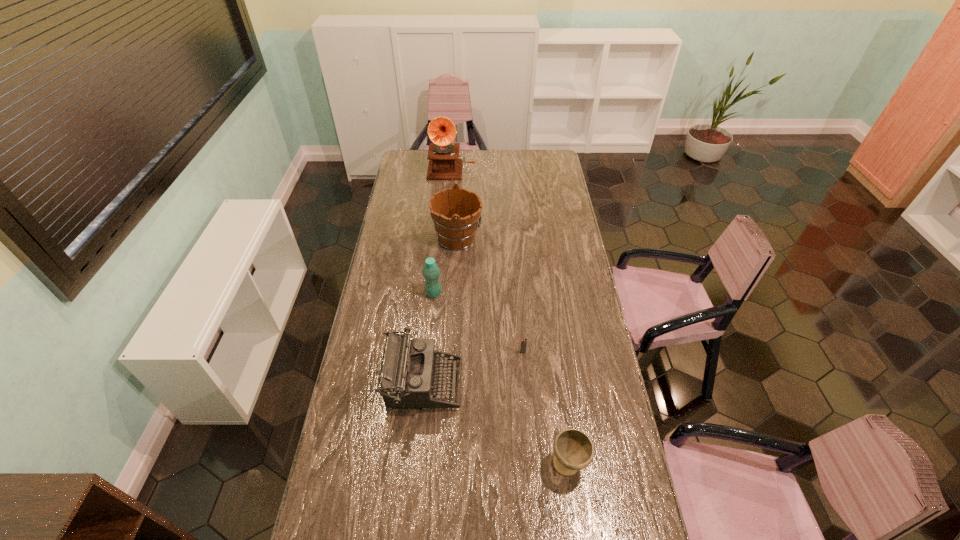
The width and height of the screenshot is (960, 540). I want to click on free space at the left edge of the desktop, so pos(410,225).

Where is `free space at the right edge of the desktop`? This screenshot has width=960, height=540. free space at the right edge of the desktop is located at coordinates (558, 242).

The height and width of the screenshot is (540, 960). I want to click on vacant space at the far left corner of the desktop, so click(x=405, y=158).

You are a GUI agent. You are given a task and a screenshot of the screen. Output one action in this format:
    pyautogui.click(x=<x>, y=<y>)
    Task: Click on the free spot between the second shortest object and the tallest object
    Image resolution: width=960 pixels, height=540 pixels.
    Given the screenshot: What is the action you would take?
    pyautogui.click(x=510, y=316)

Find the location of a particular element. vacant space in between the igniter and the nearest object is located at coordinates (545, 408).

Find the location of a particular element. free space between the nearest object and the typewriter is located at coordinates (495, 424).

Locate an element on the screen. object that can be found as the fourth closest to the third farthest object is located at coordinates (574, 450).

Where is `object that is the closest to the typewriter`? The image size is (960, 540). object that is the closest to the typewriter is located at coordinates (523, 346).

Locate an element on the screen. This screenshot has width=960, height=540. vacant point that satisfies the following two spatial constraints: 1. on the horn of the farthest object; 2. on the right side of the nearest object is located at coordinates (428, 464).

At what (x,y) coordinates should I click in order to perform the action: click on blank area in the image that satisfies the following two spatial constraints: 1. at the front cap of the third farthest object; 2. on the back side of the rightmost object. Please return your answer as a coordinate pair (x, y). Image resolution: width=960 pixels, height=540 pixels. Looking at the image, I should click on (417, 464).